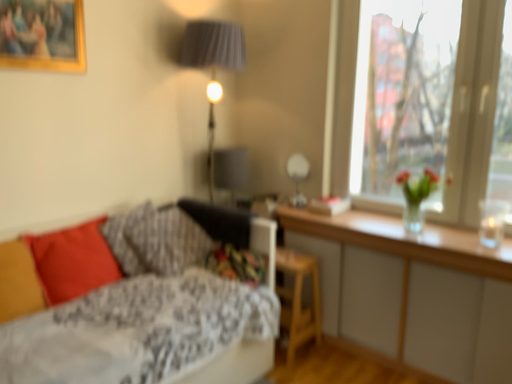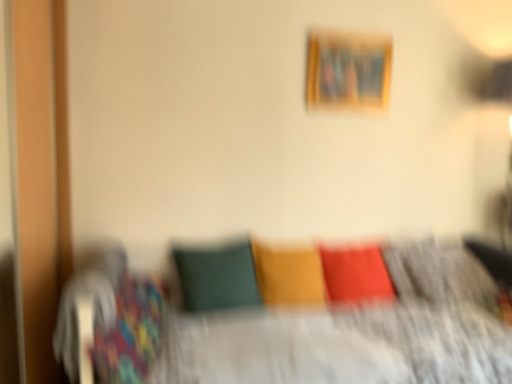
Question: How did the camera likely rotate when shooting the video?

Choices:
 (A) rotated downward
 (B) rotated upward

Answer: (B)